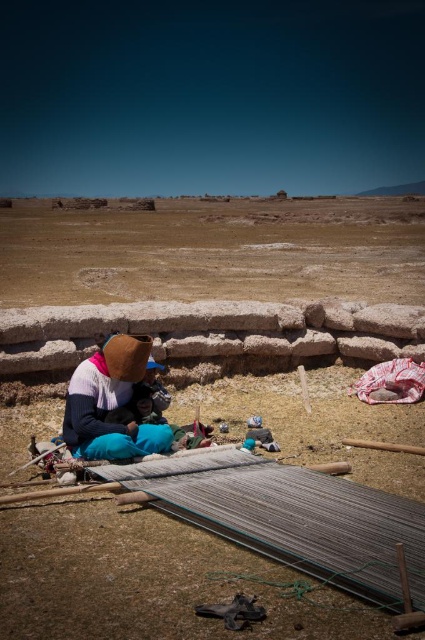
Question: Does brown dry soil at center have a larger size compared to brown woolen hat at center?

Choices:
 (A) yes
 (B) no

Answer: (A)

Question: Can you confirm if brown dry soil at center is bigger than brown woolen hat at center?

Choices:
 (A) yes
 (B) no

Answer: (A)

Question: Which point is farther to the camera?

Choices:
 (A) (104, 396)
 (B) (81, 278)

Answer: (B)

Question: Which of the following is the closest to the observer?

Choices:
 (A) brown dry soil at center
 (B) brown woolen hat at center

Answer: (B)

Question: Does brown dry soil at center have a larger size compared to brown woolen hat at center?

Choices:
 (A) yes
 (B) no

Answer: (A)